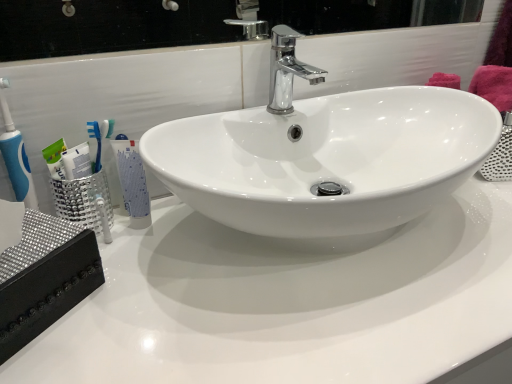
Where is `empty space that is to the right of white glossy tube at left`? The height and width of the screenshot is (384, 512). empty space that is to the right of white glossy tube at left is located at coordinates (213, 238).